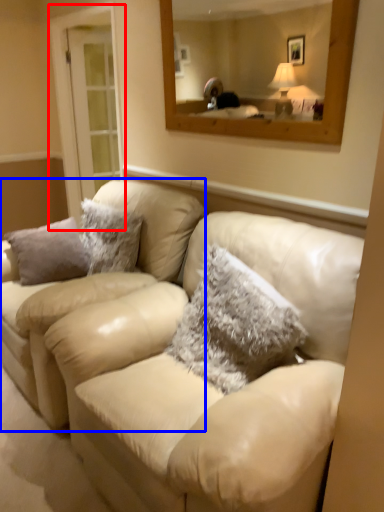
Question: Which point is further to the camera, glass door (highlighted by a red box) or couch (highlighted by a blue box)?

Choices:
 (A) glass door
 (B) couch

Answer: (A)